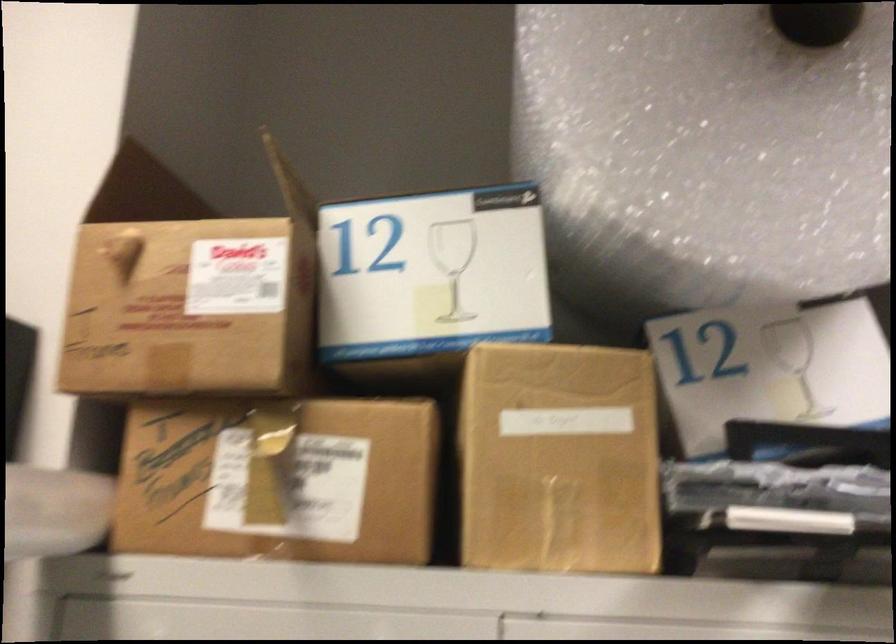
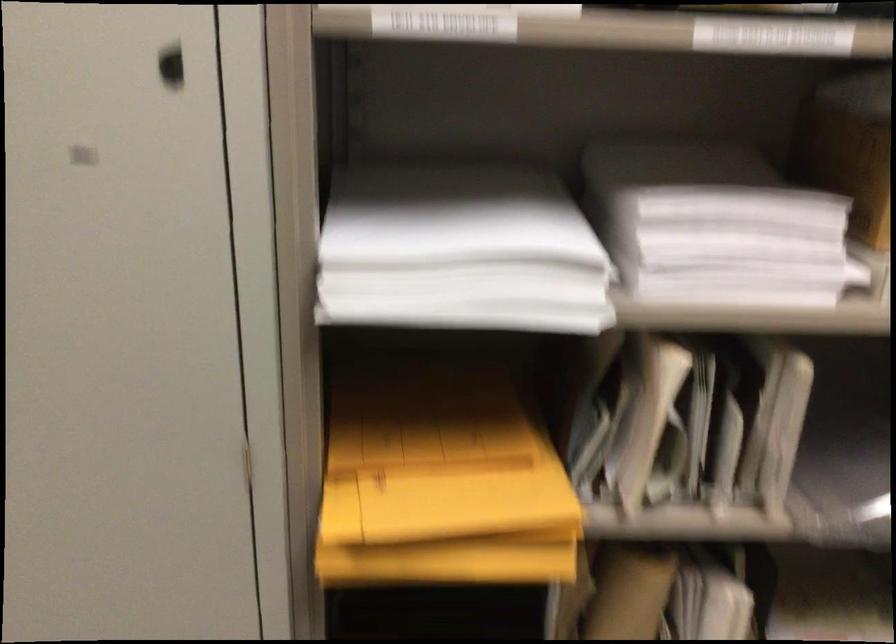
Question: In a continuous first-person perspective shot, in which direction is the camera moving?

Choices:
 (A) Left
 (B) Right
 (C) Forward
 (D) Backward

Answer: (D)